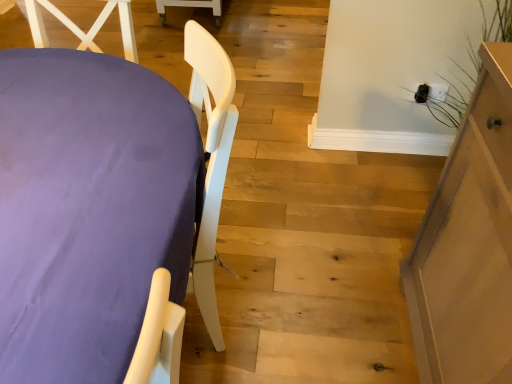
Question: Is purple fabric-covered table at left, arranged as the 1th furniture when viewed from the left, closer to camera compared to light brown wooden cabinet at right, which ranks as the second furniture in left-to-right order?

Choices:
 (A) no
 (B) yes

Answer: (B)

Question: Considering the relative sizes of purple fabric-covered table at left, arranged as the 1th furniture when viewed from the left, and light brown wooden cabinet at right, acting as the first furniture starting from the right, in the image provided, is purple fabric-covered table at left, arranged as the 1th furniture when viewed from the left, shorter than light brown wooden cabinet at right, acting as the first furniture starting from the right,?

Choices:
 (A) yes
 (B) no

Answer: (A)

Question: Is purple fabric-covered table at left, which ranks as the 2th furniture in right-to-left order, outside of light brown wooden cabinet at right, acting as the first furniture starting from the right?

Choices:
 (A) no
 (B) yes

Answer: (B)

Question: From the image's perspective, is purple fabric-covered table at left, which ranks as the 2th furniture in right-to-left order, located beneath light brown wooden cabinet at right, which ranks as the second furniture in left-to-right order?

Choices:
 (A) no
 (B) yes

Answer: (A)

Question: Is purple fabric-covered table at left, which ranks as the 2th furniture in right-to-left order, facing towards light brown wooden cabinet at right, acting as the first furniture starting from the right?

Choices:
 (A) yes
 (B) no

Answer: (B)

Question: From a real-world perspective, does purple fabric-covered table at left, arranged as the 1th furniture when viewed from the left, stand above light brown wooden cabinet at right, which ranks as the second furniture in left-to-right order?

Choices:
 (A) no
 (B) yes

Answer: (A)

Question: Can purple fabric-covered table at left, which ranks as the 2th furniture in right-to-left order, be found inside light brown wooden cabinet at right, acting as the first furniture starting from the right?

Choices:
 (A) yes
 (B) no

Answer: (B)

Question: Is light brown wooden cabinet at right, acting as the first furniture starting from the right, behind purple fabric-covered table at left, which ranks as the 2th furniture in right-to-left order?

Choices:
 (A) yes
 (B) no

Answer: (A)

Question: Is light brown wooden cabinet at right, which ranks as the second furniture in left-to-right order, positioned far away from purple fabric-covered table at left, which ranks as the 2th furniture in right-to-left order?

Choices:
 (A) no
 (B) yes

Answer: (A)

Question: Can you confirm if light brown wooden cabinet at right, which ranks as the second furniture in left-to-right order, is wider than purple fabric-covered table at left, arranged as the 1th furniture when viewed from the left?

Choices:
 (A) yes
 (B) no

Answer: (B)

Question: Can you confirm if light brown wooden cabinet at right, which ranks as the second furniture in left-to-right order, is smaller than purple fabric-covered table at left, which ranks as the 2th furniture in right-to-left order?

Choices:
 (A) yes
 (B) no

Answer: (A)

Question: Is light brown wooden cabinet at right, which ranks as the second furniture in left-to-right order, taller than purple fabric-covered table at left, arranged as the 1th furniture when viewed from the left?

Choices:
 (A) yes
 (B) no

Answer: (A)

Question: Looking at the image, does purple fabric-covered table at left, which ranks as the 2th furniture in right-to-left order, seem bigger or smaller compared to light brown wooden cabinet at right, acting as the first furniture starting from the right?

Choices:
 (A) small
 (B) big

Answer: (B)